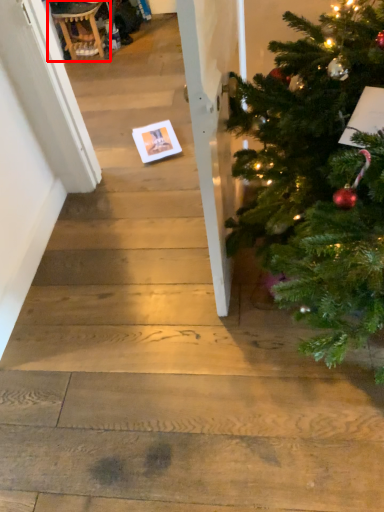
Question: Where is rocking chair (annotated by the red box) located in relation to christmas card in the image?

Choices:
 (A) left
 (B) right

Answer: (A)